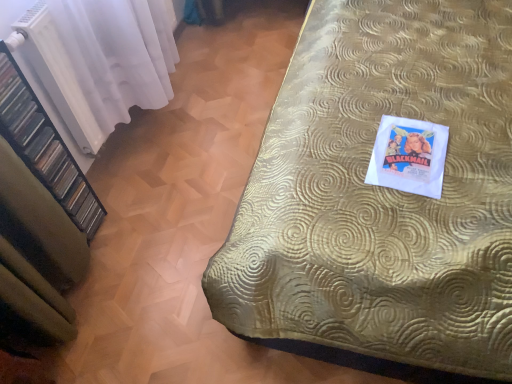
Where is `free location above gold textured bedspread at upper right (from a real-world perspective)`? The width and height of the screenshot is (512, 384). free location above gold textured bedspread at upper right (from a real-world perspective) is located at coordinates (221, 142).